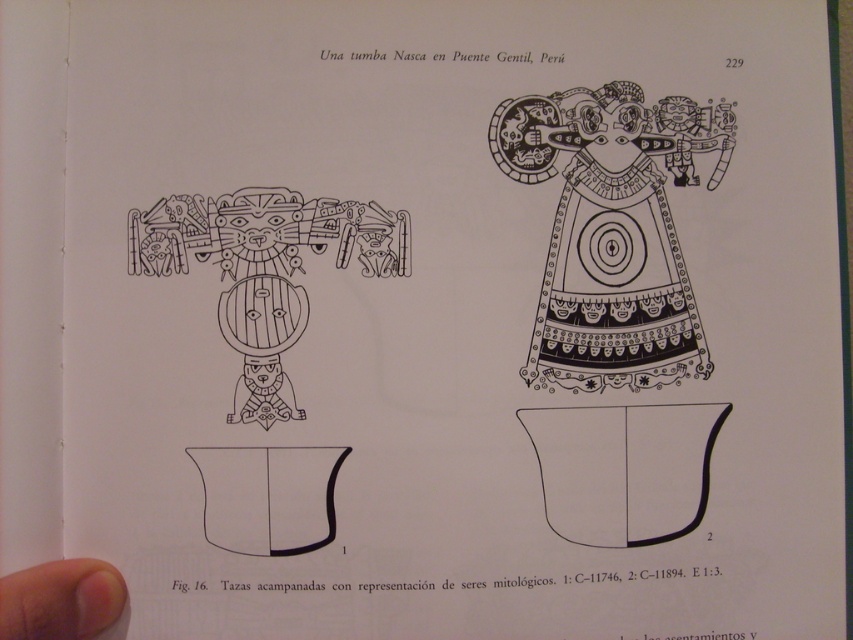
What is the position of the point at coordinates (614, 285) in the illustration?

The point at coordinates (614, 285) is located on the black matte dress at the center.

You are examining the illustration of the bell shaped cup. There is a black matte dress at center and a wooden figure at center. Which object is located to the right of the other?

The black matte dress at center is positioned on the right side of wooden figure at center.